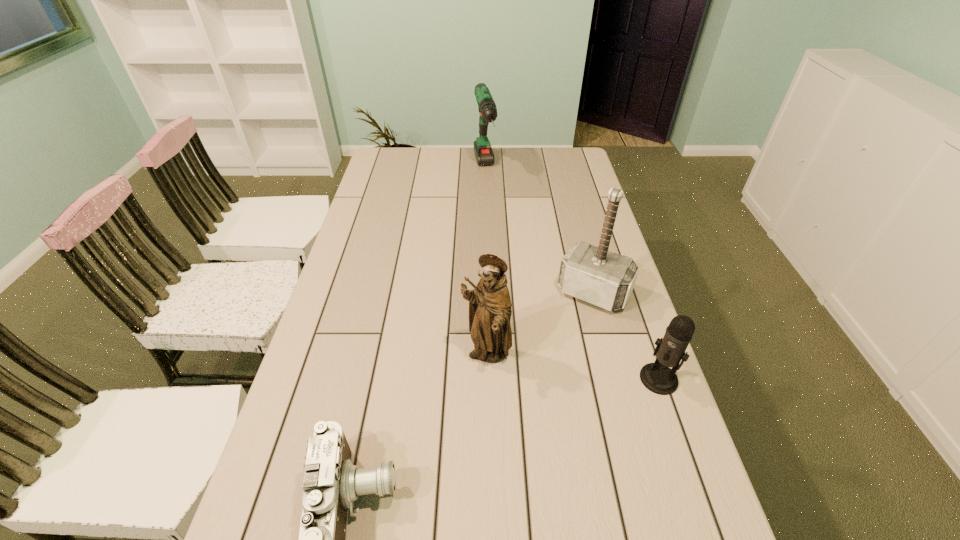
Find the location of `the second shortest object`. the second shortest object is located at coordinates (657, 377).

I want to click on the fourth nearest object, so click(593, 274).

Find the location of a particular element. the farthest object is located at coordinates pos(483,151).

The width and height of the screenshot is (960, 540). What are the coordinates of `figurine` in the screenshot? It's located at (490, 311).

This screenshot has height=540, width=960. I want to click on free space located 0.230m on the front of the second shortest object, so click(699, 495).

Image resolution: width=960 pixels, height=540 pixels. Identify the location of free space located 0.120m for striking with the head of the hammer. (563, 341).

The image size is (960, 540). What are the coordinates of `free space located for striking with the head of the hammer` in the screenshot? It's located at (535, 388).

This screenshot has width=960, height=540. What are the coordinates of `vacant space positioned for striking with the head of the hammer` in the screenshot? It's located at (535, 388).

This screenshot has height=540, width=960. Identify the location of free space located on the handle side of the farthest object. (497, 233).

Find the location of a particular element. free spot located on the handle side of the farthest object is located at coordinates (492, 213).